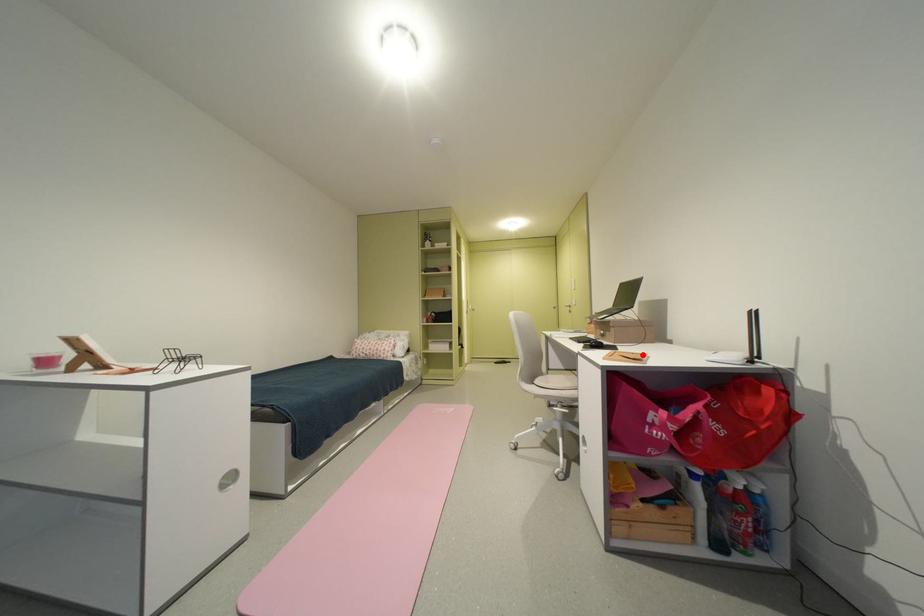
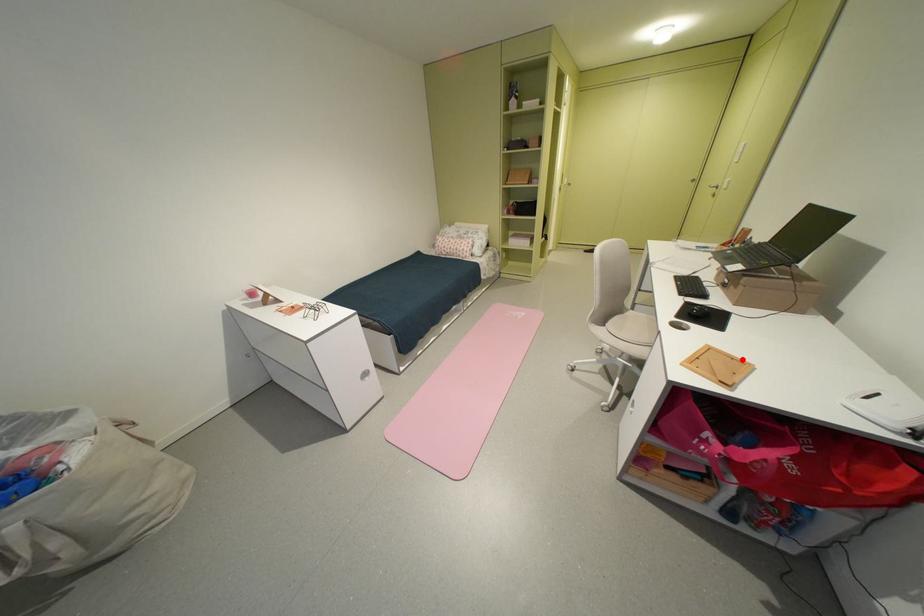
I am providing you with two images of the same scene from different viewpoints. A red point is marked on the first image and another point is marked on the second image. Is the marked point in image1 the same physical position as the marked point in image2?

Yes